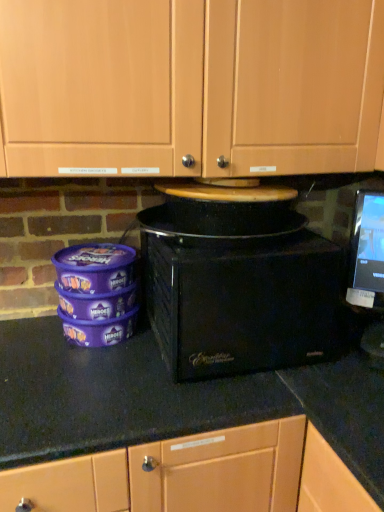
Where is `black plastic microwave at center`? black plastic microwave at center is located at coordinates (238, 288).

The width and height of the screenshot is (384, 512). Describe the element at coordinates (238, 288) in the screenshot. I see `black plastic microwave at center` at that location.

The height and width of the screenshot is (512, 384). Describe the element at coordinates (190, 86) in the screenshot. I see `wooden cabinet doors at upper center` at that location.

At what (x,y) coordinates should I click in order to perform the action: click on wooden cabinet doors at upper center. Please return your answer as a coordinate pair (x, y). This screenshot has width=384, height=512. Looking at the image, I should click on (190, 86).

What is the approximate width of wooden cabinet doors at upper center?

wooden cabinet doors at upper center is 12.46 inches in width.

I want to click on black plastic microwave at center, so click(x=238, y=288).

Consider the image. Is wooden cabinet doors at upper center to the left or to the right of black plastic microwave at center in the image?

In the image, wooden cabinet doors at upper center appears on the left side of black plastic microwave at center.

In the image, is wooden cabinet doors at upper center positioned in front of or behind black plastic microwave at center?

Visually, wooden cabinet doors at upper center is located in front of black plastic microwave at center.

Is point (103, 48) in front of point (335, 315)?

Yes, it is.

From the image's perspective, would you say wooden cabinet doors at upper center is shown under black plastic microwave at center?

No, from the image's perspective, wooden cabinet doors at upper center is not beneath black plastic microwave at center.

From a real-world perspective, is wooden cabinet doors at upper center physically above black plastic microwave at center?

Yes.

Considering the sizes of objects wooden cabinet doors at upper center and black plastic microwave at center in the image provided, who is wider, wooden cabinet doors at upper center or black plastic microwave at center?

black plastic microwave at center.

Who is shorter, wooden cabinet doors at upper center or black plastic microwave at center?

Standing shorter between the two is black plastic microwave at center.

Does wooden cabinet doors at upper center have a smaller size compared to black plastic microwave at center?

No.

Is wooden cabinet doors at upper center completely or partially outside of black plastic microwave at center?

wooden cabinet doors at upper center lies outside black plastic microwave at center's area.

Is there a large distance between wooden cabinet doors at upper center and black plastic microwave at center?

That's not correct — wooden cabinet doors at upper center is a little close to black plastic microwave at center.

Does wooden cabinet doors at upper center turn towards black plastic microwave at center?

No, wooden cabinet doors at upper center is not aimed at black plastic microwave at center.

How many degrees apart are the facing directions of wooden cabinet doors at upper center and black plastic microwave at center?

They differ by 0.364 degrees in their facing directions.

Measure the distance from wooden cabinet doors at upper center to black plastic microwave at center.

11.94 inches.

I want to click on home appliance on the right of wooden cabinet doors at upper center, so click(238, 288).

Between black plastic microwave at center and wooden cabinet doors at upper center, which one appears on the left side from the viewer's perspective?

From the viewer's perspective, wooden cabinet doors at upper center appears more on the left side.

In the image, is black plastic microwave at center positioned in front of or behind wooden cabinet doors at upper center?

black plastic microwave at center is positioned farther from the viewer than wooden cabinet doors at upper center.

Which is closer, (192, 314) or (358, 51)?

The point (192, 314) is more forward.

From the image's perspective, is black plastic microwave at center under wooden cabinet doors at upper center?

Indeed, from the image's perspective, black plastic microwave at center is shown beneath wooden cabinet doors at upper center.

From a real-world perspective, who is located lower, black plastic microwave at center or wooden cabinet doors at upper center?

In real-world perspective, black plastic microwave at center is lower.

Considering the sizes of objects black plastic microwave at center and wooden cabinet doors at upper center in the image provided, who is wider, black plastic microwave at center or wooden cabinet doors at upper center?

black plastic microwave at center.

In terms of height, does black plastic microwave at center look taller or shorter compared to wooden cabinet doors at upper center?

black plastic microwave at center is shorter than wooden cabinet doors at upper center.

Who is bigger, black plastic microwave at center or wooden cabinet doors at upper center?

With larger size is wooden cabinet doors at upper center.

Would you say black plastic microwave at center contains wooden cabinet doors at upper center?

Definitely not — wooden cabinet doors at upper center is not inside black plastic microwave at center.

Is there a large distance between black plastic microwave at center and wooden cabinet doors at upper center?

No, black plastic microwave at center is not far away from wooden cabinet doors at upper center.

Could you tell me if black plastic microwave at center is facing wooden cabinet doors at upper center?

No, black plastic microwave at center is not oriented towards wooden cabinet doors at upper center.

How different are the orientations of black plastic microwave at center and wooden cabinet doors at upper center in degrees?

The angle between the facing direction of black plastic microwave at center and the facing direction of wooden cabinet doors at upper center is 0.364 degrees.

How far apart are black plastic microwave at center and wooden cabinet doors at upper center?

black plastic microwave at center and wooden cabinet doors at upper center are 11.94 inches apart.

Where is `cabinetry above the black plastic microwave at center (from the image's perspective)`? The height and width of the screenshot is (512, 384). cabinetry above the black plastic microwave at center (from the image's perspective) is located at coordinates (190, 86).

Where is `cabinetry above the black plastic microwave at center (from a real-world perspective)`? The height and width of the screenshot is (512, 384). cabinetry above the black plastic microwave at center (from a real-world perspective) is located at coordinates (190, 86).

The image size is (384, 512). What are the coordinates of `cabinetry that appears above the black plastic microwave at center (from the image's perspective)` in the screenshot? It's located at (190, 86).